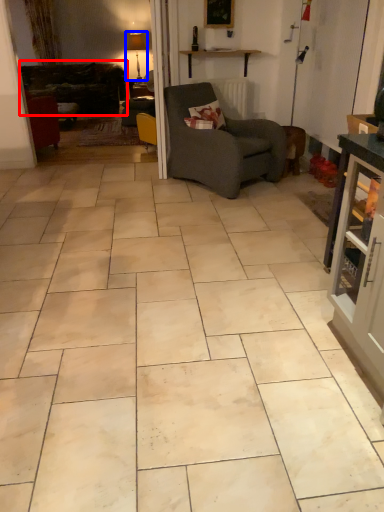
Question: Which of the following is the farthest to the observer, studio couch (highlighted by a red box) or lamp (highlighted by a blue box)?

Choices:
 (A) studio couch
 (B) lamp

Answer: (B)